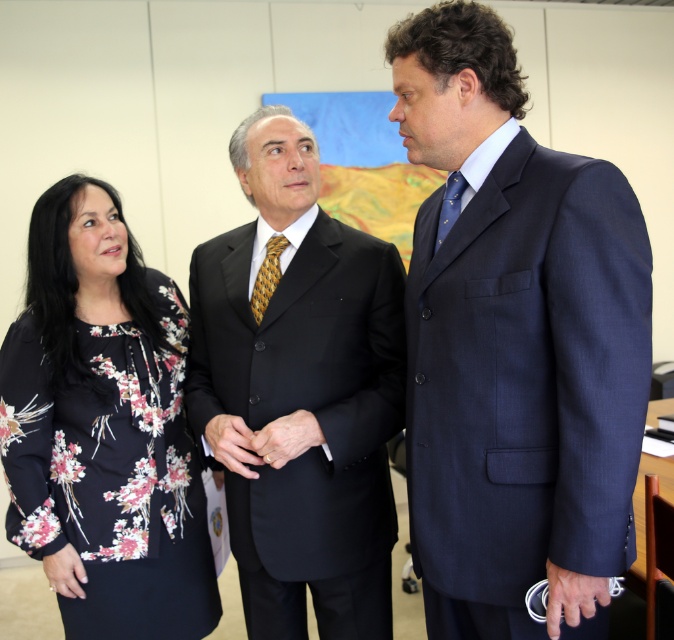
Question: Among these points, which one is farthest from the camera?

Choices:
 (A) (293, 340)
 (B) (125, 257)
 (C) (274, 284)
 (D) (470, 218)

Answer: (B)

Question: Which object is farther from the camera taking this photo?

Choices:
 (A) matte black suit at center
 (B) yellowstriped fabrictie at center
 (C) floral-patterned fabric dress at left
 (D) blue silk tie at right

Answer: (C)

Question: Does matte black suit at center appear under floral-patterned fabric dress at left?

Choices:
 (A) no
 (B) yes

Answer: (A)

Question: Estimate the real-world distances between objects in this image. Which object is closer to the yellowstriped fabrictie at center?

Choices:
 (A) navy blue suit at center
 (B) floral-patterned fabric dress at left
 (C) blue silk tie at right

Answer: (C)

Question: Is the position of matte black suit at center less distant than that of blue silk tie at right?

Choices:
 (A) no
 (B) yes

Answer: (A)

Question: Is navy blue suit at center bigger than floral-patterned fabric dress at left?

Choices:
 (A) yes
 (B) no

Answer: (A)